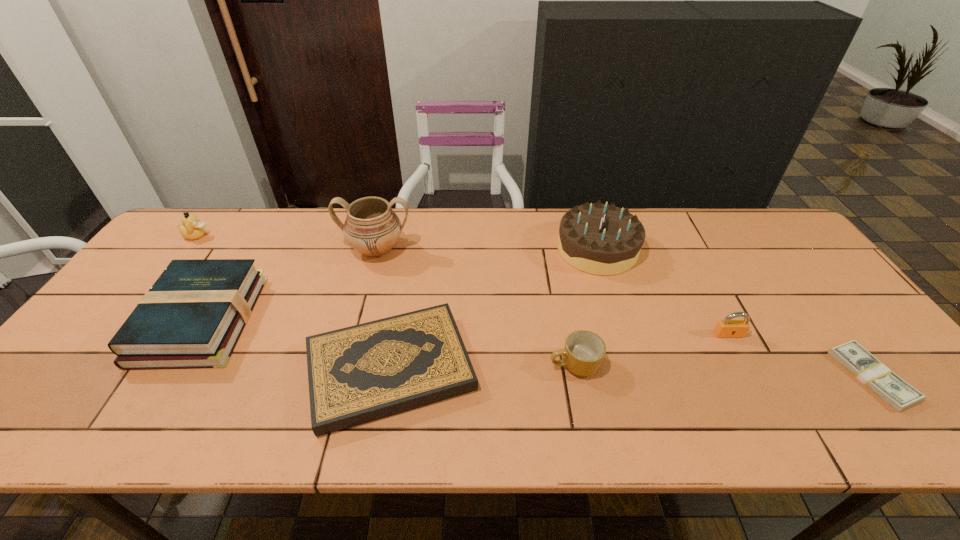
Where is `free point that satisfies the following two spatial constraints: 1. on the back side of the rightmost object; 2. on the face of the duckling`? The height and width of the screenshot is (540, 960). free point that satisfies the following two spatial constraints: 1. on the back side of the rightmost object; 2. on the face of the duckling is located at coordinates (764, 236).

I want to click on vacant space that satisfies the following two spatial constraints: 1. on the front-facing side of the seventh shortest object; 2. on the left side of the dollar, so click(x=636, y=376).

Locate an element on the screen. The height and width of the screenshot is (540, 960). free space that satisfies the following two spatial constraints: 1. on the front-facing side of the birthday cake; 2. on the front-facing side of the tallest object is located at coordinates (597, 249).